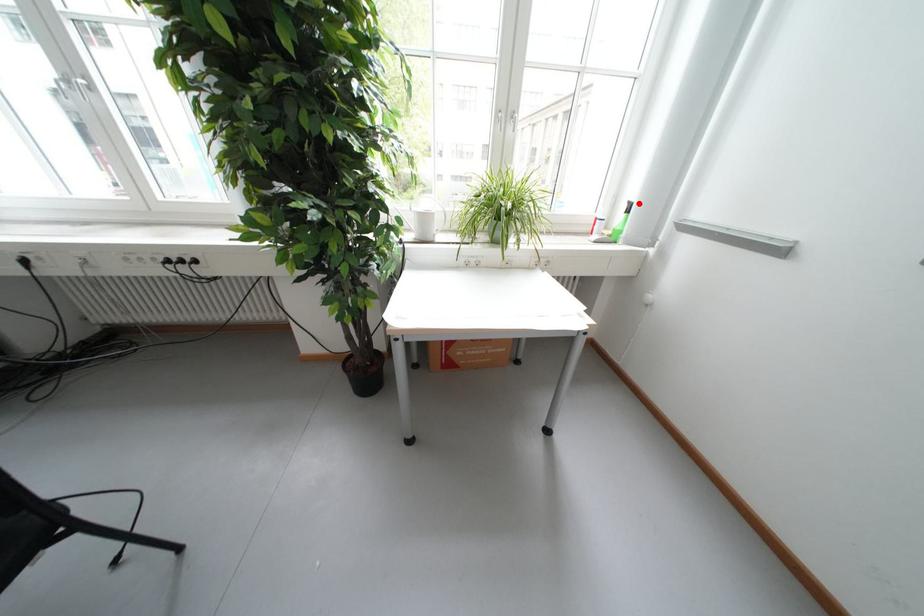
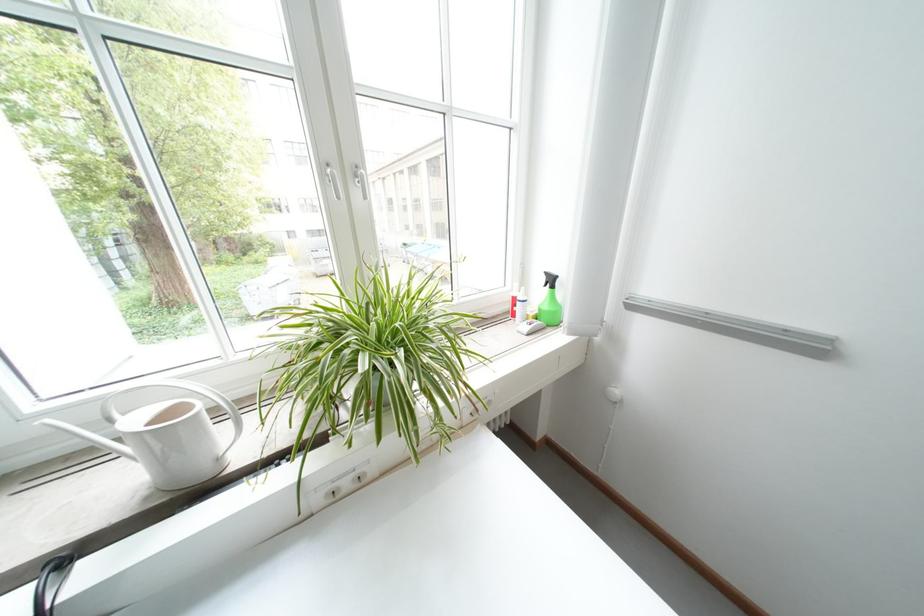
Question: I am providing you with two images of the same scene from different viewpoints. Given a red point in image1, look at the same physical point in image2. Is it:

Choices:
 (A) Closer to the viewpoint
 (B) Farther from the viewpoint

Answer: (B)